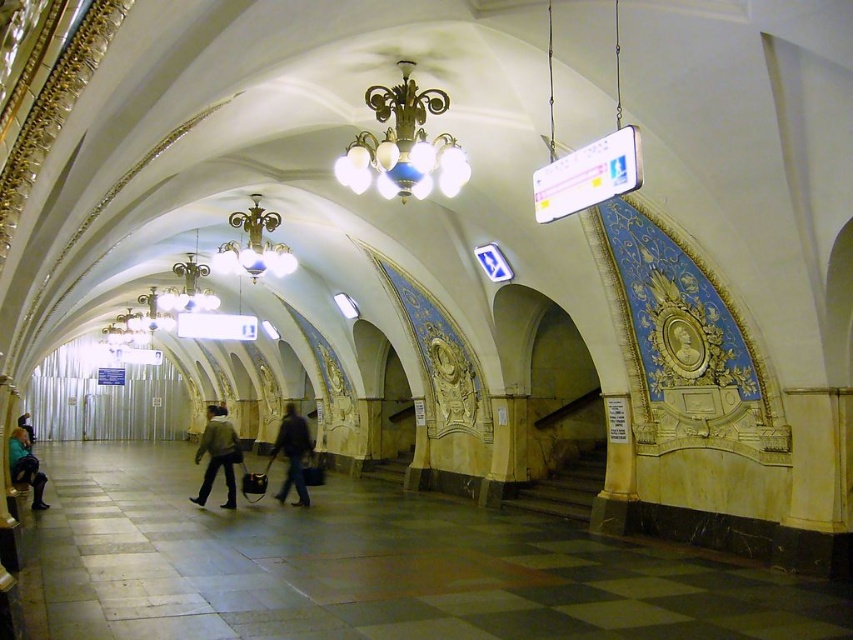
You are a subway passenger who just entered the station and sees the light brown leather jacket at center and the matte black jacket at lower left. Which jacket is closer to the floor?

The light brown leather jacket at center is closer to the floor because it is positioned below the matte black jacket at lower left.

You are a passenger waiting at the subway station and notice a point marked at coordinates (25, 467). What object is located at that point?

The point at coordinates (25, 467) corresponds to the matte black jacket at lower left.

You are a security guard in the subway station and need to store both the light brown leather jacket at center and the matte black jacket at lower left in a locker that can only hold one large item. Which jacket should you choose to fit in the locker?

The light brown leather jacket at center is bigger than the matte black jacket at lower left, so you should choose the matte black jacket at lower left to fit in the locker since it is smaller.